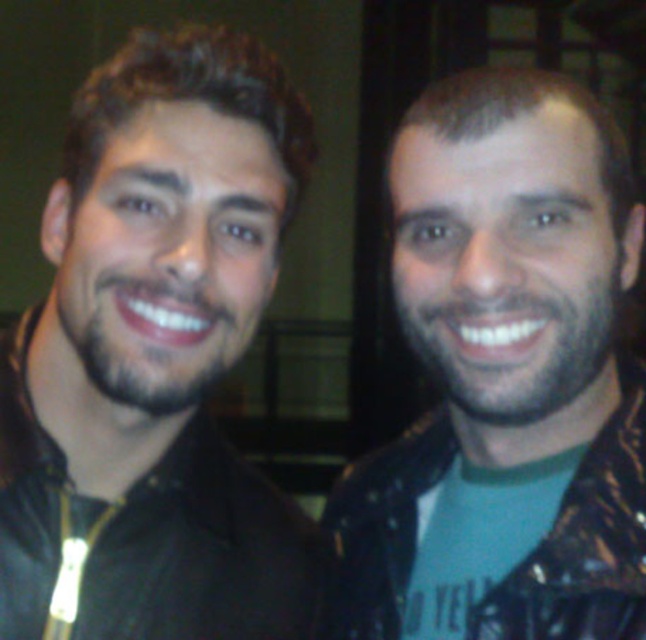
You are standing in the same room as the two people in the image. You need to walk to the point marked by the coordinates point (156, 499) and point (364, 577). Which point should you reach first if you want to get to both in the shortest path possible?

You should reach point (156, 499) first because it is closer to you than point (364, 577), which is further away.

You are a photographer trying to capture a closeup of both jackets in the image. Given that your camera can only focus on objects within 6 inches of each other, will you be able to focus on both the black leather jacket at left and the leather jacket at right simultaneously?

The black leather jacket at left is 7.08 inches from the leather jacket at right, which is beyond the 6 inches focus range. Therefore, you cannot focus on both jackets simultaneously.